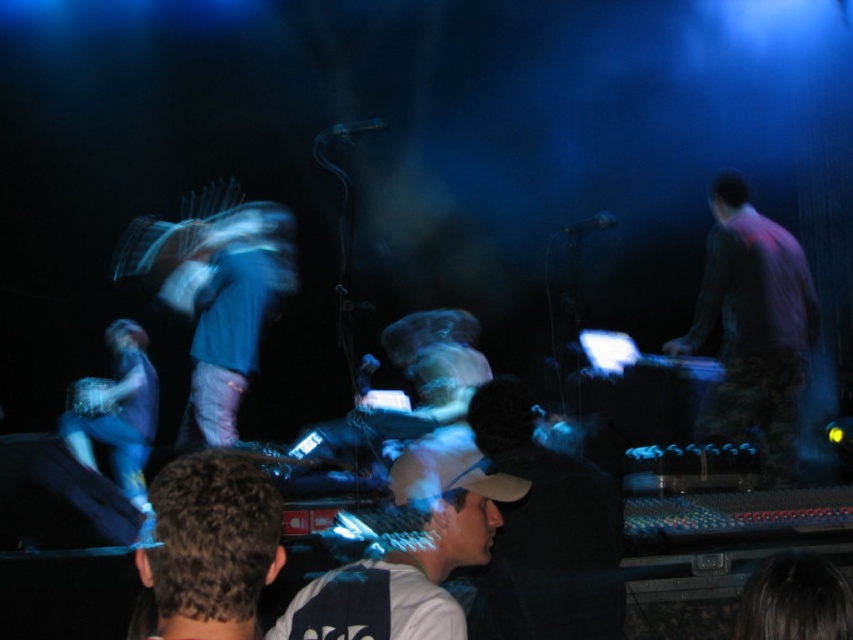
Which is below, purple shirt at right or white matte cap at center?

white matte cap at center is lower down.

Between purple shirt at right and white matte cap at center, which one has more height?

purple shirt at right is taller.

Who is more distant from viewer, (x=792, y=420) or (x=427, y=573)?

Positioned behind is point (x=792, y=420).

This screenshot has height=640, width=853. Identify the location of purple shirt at right. (753, 328).

Is white matte cap at center to the right of denim pants at left from the viewer's perspective?

Correct, you'll find white matte cap at center to the right of denim pants at left.

In the scene shown: Who is higher up, white matte cap at center or denim pants at left?

white matte cap at center is above.

The image size is (853, 640). Identify the location of white matte cap at center. (412, 554).

Identify the location of white matte cap at center. 412,554.

Which of these two, purple shirt at right or denim pants at left, stands shorter?

denim pants at left

Which is above, purple shirt at right or denim pants at left?

purple shirt at right is higher up.

Identify the location of purple shirt at right. The height and width of the screenshot is (640, 853). (753, 328).

This screenshot has width=853, height=640. I want to click on purple shirt at right, so click(x=753, y=328).